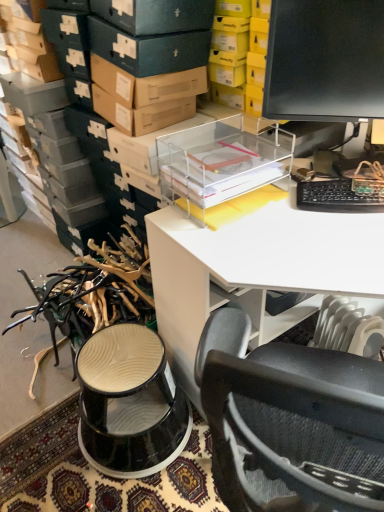
Question: Considering the relative sizes of transparent plastic desk at upper center and black plastic keyboard at right in the image provided, is transparent plastic desk at upper center wider than black plastic keyboard at right?

Choices:
 (A) no
 (B) yes

Answer: (B)

Question: Considering the relative sizes of transparent plastic desk at upper center and black plastic keyboard at right in the image provided, is transparent plastic desk at upper center bigger than black plastic keyboard at right?

Choices:
 (A) yes
 (B) no

Answer: (A)

Question: From the image's perspective, would you say transparent plastic desk at upper center is shown under black plastic keyboard at right?

Choices:
 (A) no
 (B) yes

Answer: (B)

Question: From a real-world perspective, is transparent plastic desk at upper center below black plastic keyboard at right?

Choices:
 (A) yes
 (B) no

Answer: (A)

Question: Is black plastic keyboard at right located within transparent plastic desk at upper center?

Choices:
 (A) no
 (B) yes

Answer: (B)

Question: Considering the relative sizes of transparent plastic desk at upper center and black plastic keyboard at right in the image provided, is transparent plastic desk at upper center taller than black plastic keyboard at right?

Choices:
 (A) yes
 (B) no

Answer: (A)

Question: Is black plastic keyboard at right further to the viewer compared to transparent plastic desk at upper center?

Choices:
 (A) yes
 (B) no

Answer: (A)

Question: From a real-world perspective, is black plastic keyboard at right located beneath transparent plastic desk at upper center?

Choices:
 (A) no
 (B) yes

Answer: (A)

Question: Could transparent plastic desk at upper center be considered to be inside black plastic keyboard at right?

Choices:
 (A) no
 (B) yes

Answer: (A)

Question: Is black plastic keyboard at right far away from transparent plastic desk at upper center?

Choices:
 (A) no
 (B) yes

Answer: (A)

Question: Considering the relative sizes of black plastic keyboard at right and transparent plastic desk at upper center in the image provided, is black plastic keyboard at right thinner than transparent plastic desk at upper center?

Choices:
 (A) yes
 (B) no

Answer: (A)

Question: Can you confirm if black plastic keyboard at right is shorter than transparent plastic desk at upper center?

Choices:
 (A) yes
 (B) no

Answer: (A)

Question: From a real-world perspective, is black glossy monitor at upper right on top of transparent plastic desk at upper center?

Choices:
 (A) no
 (B) yes

Answer: (B)